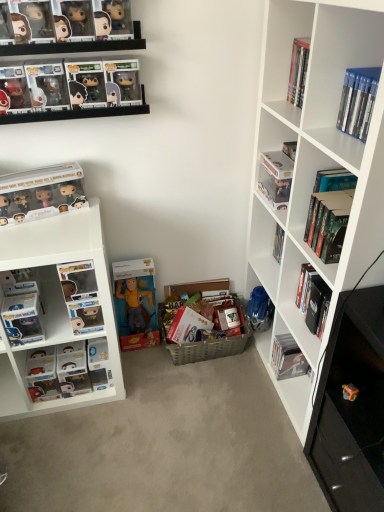
Identify the location of vacant space in front of matte black pop vinyl figures at upper left, which is the first book in left-to-right order. (42, 241).